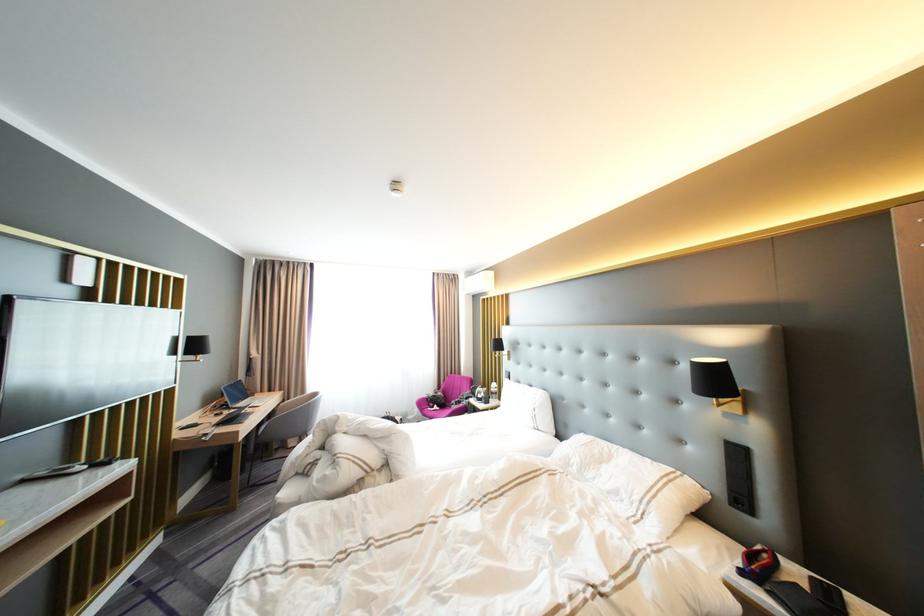
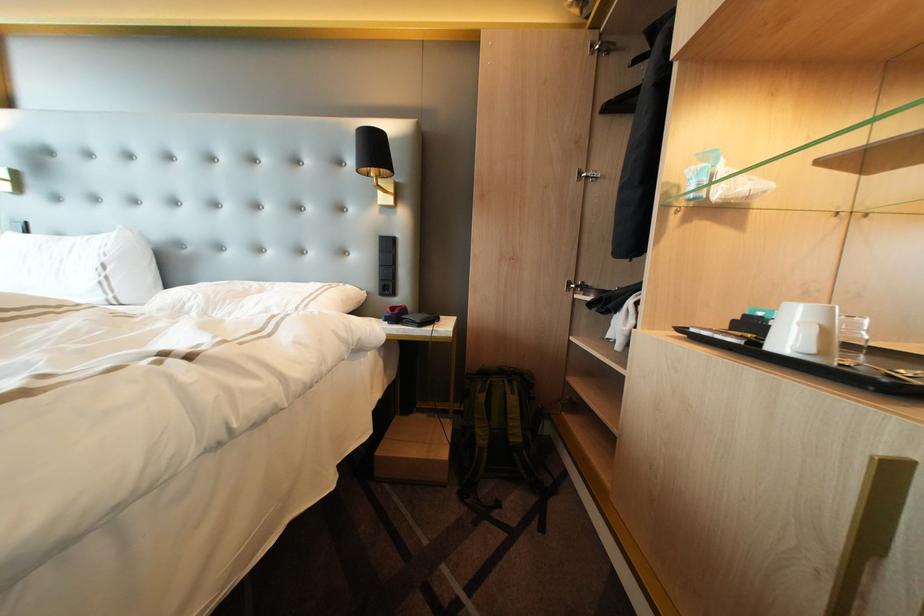
The point at (732, 488) is marked in the first image. Where is the corresponding point in the second image?

(384, 284)